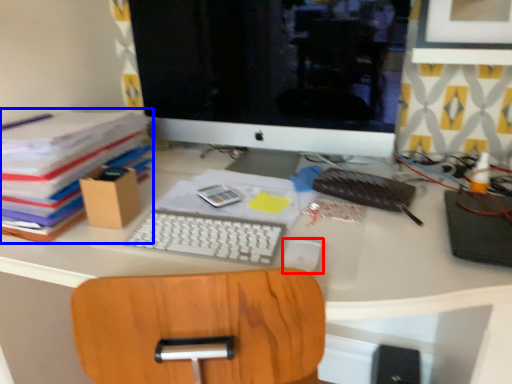
Question: Among these objects, which one is nearest to the camera, mouse (highlighted by a red box) or paperback book (highlighted by a blue box)?

Choices:
 (A) mouse
 (B) paperback book

Answer: (A)